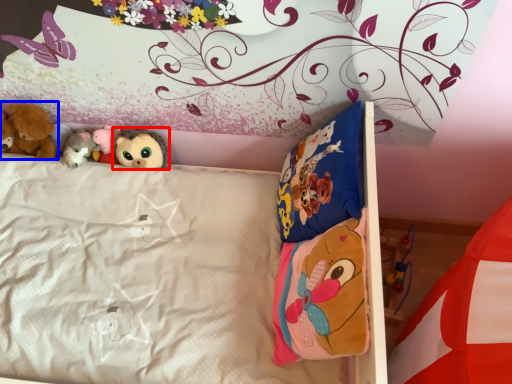
Question: Which of the following is the closest to the observer, toy (highlighted by a red box) or toy (highlighted by a blue box)?

Choices:
 (A) toy
 (B) toy

Answer: (B)